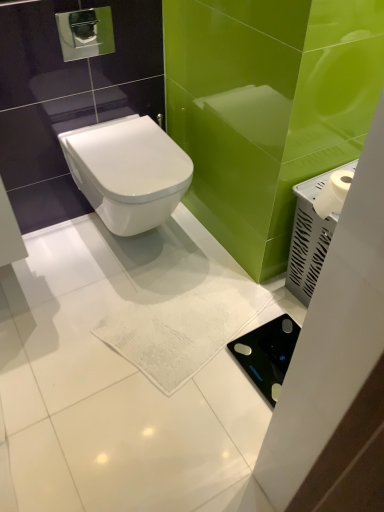
This screenshot has width=384, height=512. I want to click on white glossy toilet at center, so click(x=128, y=172).

Measure the distance between point (140, 199) and camera.

The distance of point (140, 199) from camera is 1.40 meters.

What is the approximate height of white glossy toilet at center?

The height of white glossy toilet at center is 12.83 inches.

This screenshot has height=512, width=384. What do you see at coordinates (128, 172) in the screenshot?
I see `white glossy toilet at center` at bounding box center [128, 172].

This screenshot has width=384, height=512. Identify the location of white plastic tissue holder at right. (308, 239).

Describe the element at coordinates (308, 239) in the screenshot. The height and width of the screenshot is (512, 384). I see `white plastic tissue holder at right` at that location.

The width and height of the screenshot is (384, 512). In order to click on white glossy toilet at center in this screenshot , I will do `click(128, 172)`.

Which object is positioned more to the right, white glossy toilet at center or white plastic tissue holder at right?

Positioned to the right is white plastic tissue holder at right.

Does white glossy toilet at center lie behind white plastic tissue holder at right?

Yes.

Considering the points (128, 145) and (338, 168), which point is behind, point (128, 145) or point (338, 168)?

The point (128, 145) is behind.

From the image's perspective, which object appears higher, white glossy toilet at center or white plastic tissue holder at right?

white glossy toilet at center is shown above in the image.

From a real-world perspective, is white glossy toilet at center physically below white plastic tissue holder at right?

Actually, white glossy toilet at center is physically above white plastic tissue holder at right in the real world.

Looking at their sizes, would you say white glossy toilet at center is wider or thinner than white plastic tissue holder at right?

Considering their sizes, white glossy toilet at center looks broader than white plastic tissue holder at right.

Considering the sizes of objects white glossy toilet at center and white plastic tissue holder at right in the image provided, who is shorter, white glossy toilet at center or white plastic tissue holder at right?

Standing shorter between the two is white glossy toilet at center.

Is white glossy toilet at center smaller than white plastic tissue holder at right?

No, white glossy toilet at center is not smaller than white plastic tissue holder at right.

Is white glossy toilet at center located outside white plastic tissue holder at right?

Indeed, white glossy toilet at center is completely outside white plastic tissue holder at right.

Is white glossy toilet at center with white plastic tissue holder at right?

No, white glossy toilet at center is not with white plastic tissue holder at right.

Could you tell me if white glossy toilet at center is facing white plastic tissue holder at right?

No, white glossy toilet at center does not turn towards white plastic tissue holder at right.

What's the angular difference between white glossy toilet at center and white plastic tissue holder at right's facing directions?

The angle between the facing direction of white glossy toilet at center and the facing direction of white plastic tissue holder at right is 0.000197 degrees.

How far apart are white glossy toilet at center and white plastic tissue holder at right?

They are 59.55 centimeters apart.

Find the location of a particular element. The width and height of the screenshot is (384, 512). appliance that is on the right side of white glossy toilet at center is located at coordinates (308, 239).

Considering the positions of objects white plastic tissue holder at right and white glossy toilet at center in the image provided, who is more to the left, white plastic tissue holder at right or white glossy toilet at center?

From the viewer's perspective, white glossy toilet at center appears more on the left side.

Does white plastic tissue holder at right lie behind white glossy toilet at center?

No, it is in front of white glossy toilet at center.

Does point (329, 240) appear closer or farther from the camera than point (115, 189)?

Point (329, 240).

From the image's perspective, is white plastic tissue holder at right located above or below white glossy toilet at center?

white plastic tissue holder at right is below white glossy toilet at center.

From a real-world perspective, which object stands above the other?

white glossy toilet at center, from a real-world perspective.

Is white plastic tissue holder at right wider than white glossy toilet at center?

Incorrect, the width of white plastic tissue holder at right does not surpass that of white glossy toilet at center.

From their relative heights in the image, would you say white plastic tissue holder at right is taller or shorter than white glossy toilet at center?

Considering their sizes, white plastic tissue holder at right has more height than white glossy toilet at center.

Based on their sizes in the image, would you say white plastic tissue holder at right is bigger or smaller than white glossy toilet at center?

Considering their sizes, white plastic tissue holder at right takes up less space than white glossy toilet at center.

Is white plastic tissue holder at right surrounding white glossy toilet at center?

No, white glossy toilet at center is not surrounded by white plastic tissue holder at right.

Is white plastic tissue holder at right far away from white glossy toilet at center?

No, white plastic tissue holder at right is in close proximity to white glossy toilet at center.

Is white glossy toilet at center at the back of white plastic tissue holder at right?

No, white plastic tissue holder at right's orientation is not away from white glossy toilet at center.

Can you tell me how much white plastic tissue holder at right and white glossy toilet at center differ in facing direction?

0.000197 degrees.

Find the location of a particular element. Image resolution: width=384 pixels, height=512 pixels. toilet above the white plastic tissue holder at right (from the image's perspective) is located at coordinates (128, 172).

Where is `toilet above the white plastic tissue holder at right (from the image's perspective)`? The width and height of the screenshot is (384, 512). toilet above the white plastic tissue holder at right (from the image's perspective) is located at coordinates (128, 172).

I want to click on appliance located in front of the white glossy toilet at center, so click(x=308, y=239).